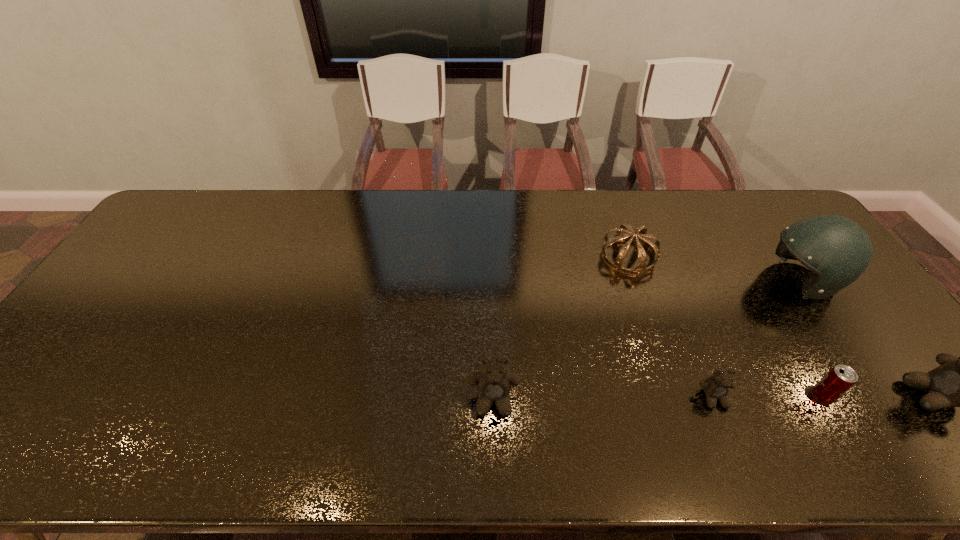
At what (x,y) coordinates should I click in order to perform the action: click on the fourth shortest object. Please return your answer as a coordinate pair (x, y). This screenshot has height=540, width=960. Looking at the image, I should click on pos(493,382).

This screenshot has height=540, width=960. Find the location of `the second tallest teddy bear`. the second tallest teddy bear is located at coordinates (493, 382).

Where is `the shortest teddy bear`? the shortest teddy bear is located at coordinates (716, 387).

Locate an element on the screen. This screenshot has width=960, height=540. tiara is located at coordinates (641, 268).

Where is `the third object from right to left`? the third object from right to left is located at coordinates (838, 380).

In order to click on the tallest object in this screenshot , I will do `click(837, 250)`.

Locate an element on the screen. free space located 0.260m on the right of the third shortest object is located at coordinates (739, 256).

Where is `free space located 0.390m on the left of the fourth object from left to right`? The width and height of the screenshot is (960, 540). free space located 0.390m on the left of the fourth object from left to right is located at coordinates (648, 396).

Locate an element on the screen. free region located 0.060m at the face opening of the football helmet is located at coordinates (742, 280).

The height and width of the screenshot is (540, 960). What are the coordinates of `free location located at the face opening of the football helmet` in the screenshot? It's located at (742, 280).